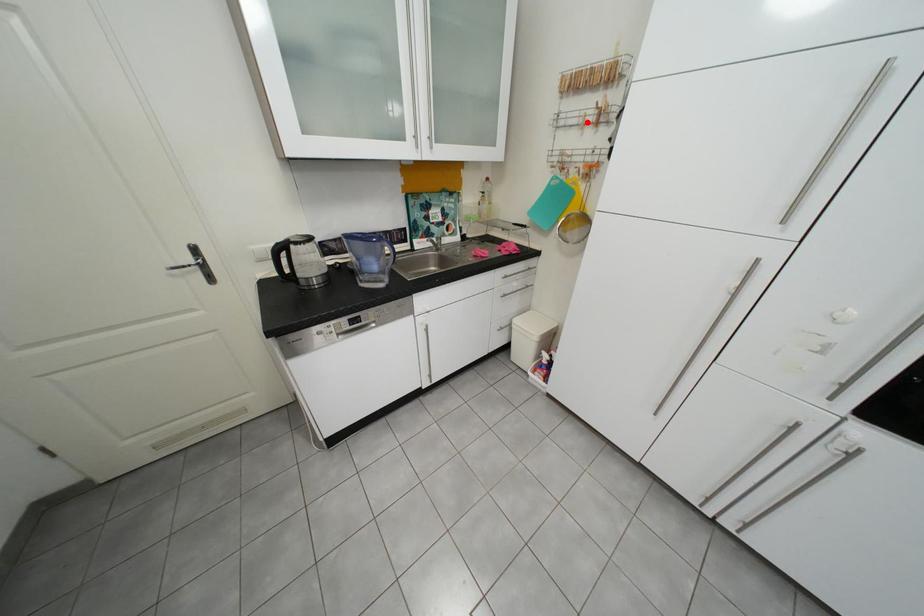
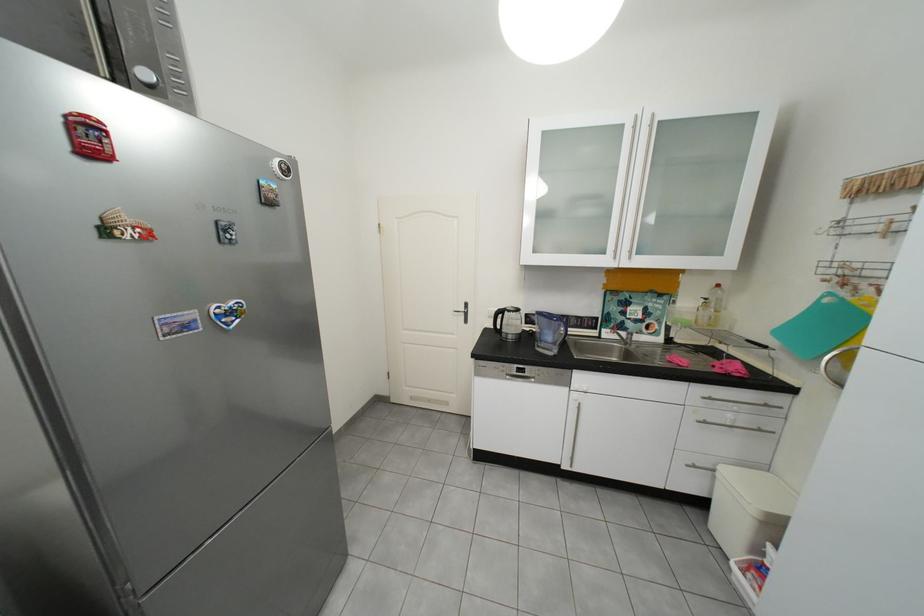
Find the pixel in the second image that matches the highlighted location in the first image.

(881, 230)